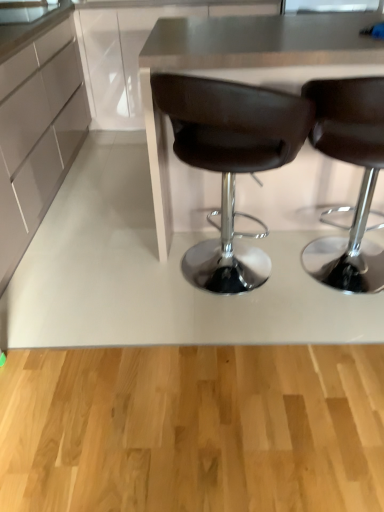
Identify the location of free space in front of brown leather chair at center, which is the 1th chair from right to left. (331, 347).